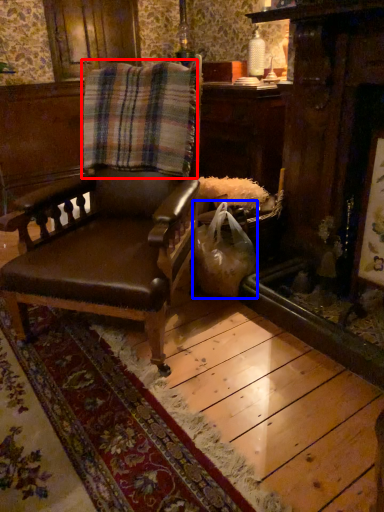
Question: Which of the following is the farthest to the observer, blanket (highlighted by a red box) or shopping bag (highlighted by a blue box)?

Choices:
 (A) blanket
 (B) shopping bag

Answer: (B)